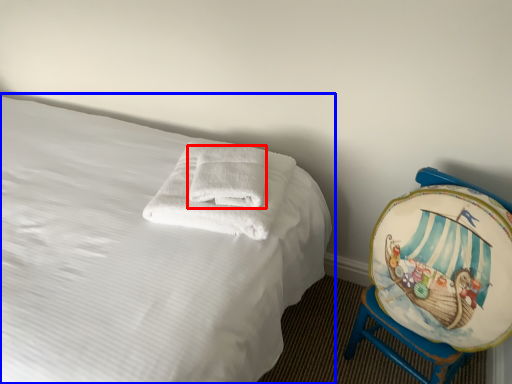
Question: Which object appears closest to the camera in this image, bath towel (highlighted by a red box) or bed (highlighted by a blue box)?

Choices:
 (A) bath towel
 (B) bed

Answer: (B)